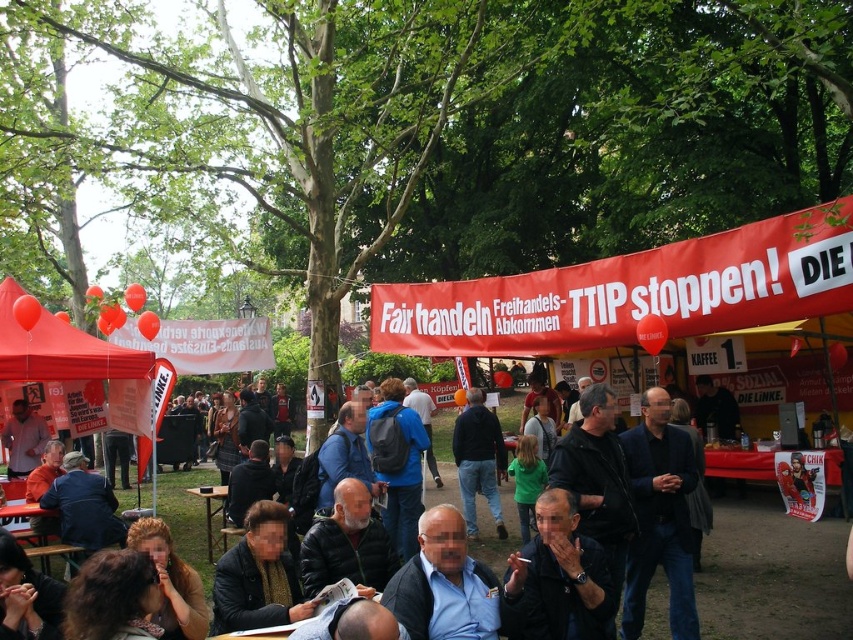
Can you confirm if dark blue suit at center is positioned above matte red canopy at left?

No, dark blue suit at center is not above matte red canopy at left.

Measure the distance from dark blue suit at center to matte red canopy at left.

The distance of dark blue suit at center from matte red canopy at left is 12.53 meters.

Which is behind, point (430, 554) or point (68, 339)?

The point (68, 339) is more distant.

Image resolution: width=853 pixels, height=640 pixels. I want to click on dark blue suit at center, so click(x=444, y=584).